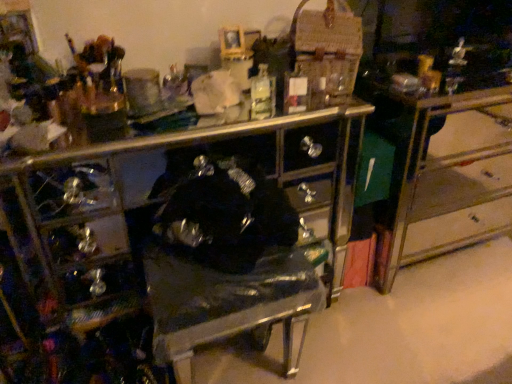
I want to click on free space in front of metallic silver table at center, so click(x=439, y=322).